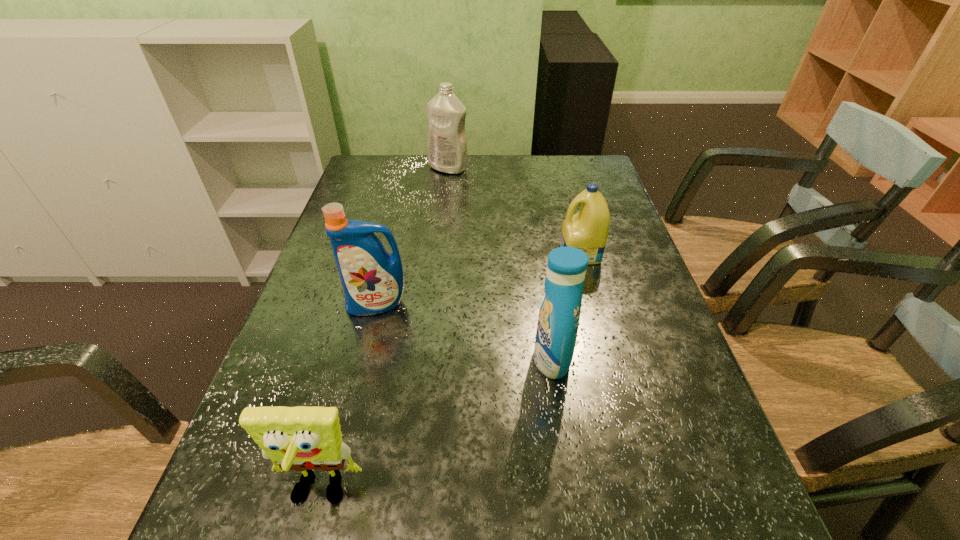
Where is `vacant space at the left edge of the desktop`? vacant space at the left edge of the desktop is located at coordinates [x=393, y=211].

In order to click on free space at the right edge in this screenshot , I will do `click(638, 264)`.

Find the location of `free location at the far left corner`. free location at the far left corner is located at coordinates (382, 156).

Locate an element on the screen. free space between the rightmost detergent and the nearest object is located at coordinates (449, 373).

The image size is (960, 540). I want to click on free spot between the third nearest object and the farthest object, so click(413, 236).

Where is `free point between the sponge and the farthest detergent`? This screenshot has width=960, height=540. free point between the sponge and the farthest detergent is located at coordinates (383, 330).

Locate an element on the screen. empty location between the farthest object and the nearest object is located at coordinates (383, 330).

The image size is (960, 540). What are the coordinates of `vacant area between the shortest detergent and the third farthest object` in the screenshot? It's located at (479, 279).

At what (x,y) coordinates should I click in order to perform the action: click on free spot between the rightmost object and the third nearest object. Please return your answer as a coordinate pair (x, y). The image size is (960, 540). Looking at the image, I should click on (479, 279).

Identify the location of free point between the sponge and the rightmost detergent. The image size is (960, 540). coord(449,373).